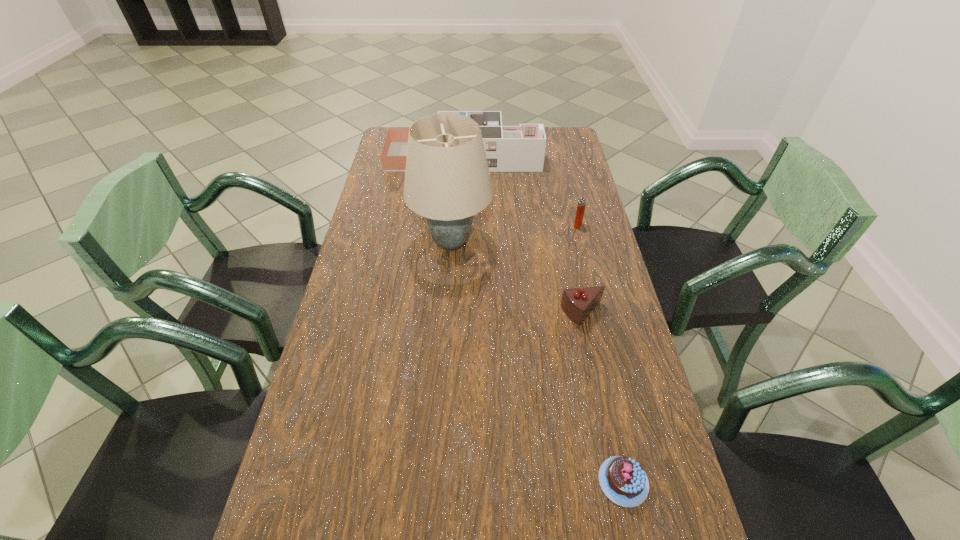
The image size is (960, 540). Find the location of `the tallest object`. the tallest object is located at coordinates (447, 180).

Where is `dollhouse`? The width and height of the screenshot is (960, 540). dollhouse is located at coordinates (521, 148).

Where is `the farthest object`? Image resolution: width=960 pixels, height=540 pixels. the farthest object is located at coordinates (521, 148).

Locate an element on the screen. the third tallest object is located at coordinates 581,206.

The width and height of the screenshot is (960, 540). What are the coordinates of `the taller chocolate cake` in the screenshot? It's located at (577, 303).

Identify the location of the second shortest object. (577, 303).

Locate an element on the screen. This screenshot has width=960, height=540. the nearer chocolate cake is located at coordinates (622, 479).

You are a GUI agent. You are given a task and a screenshot of the screen. Output one action in this format:
    pyautogui.click(x=<x>, y=<y>)
    Task: Click on the shortest object
    The image size is (960, 540).
    Given the screenshot: What is the action you would take?
    pyautogui.click(x=622, y=479)

At what (x,y) coordinates should I click in order to perform the action: click on blank space located 0.070m on the left of the lampshade. Please return your answer as a coordinate pair (x, y). Looking at the image, I should click on (388, 242).

I want to click on vacant region located at the front door of the farthest object, so click(568, 157).